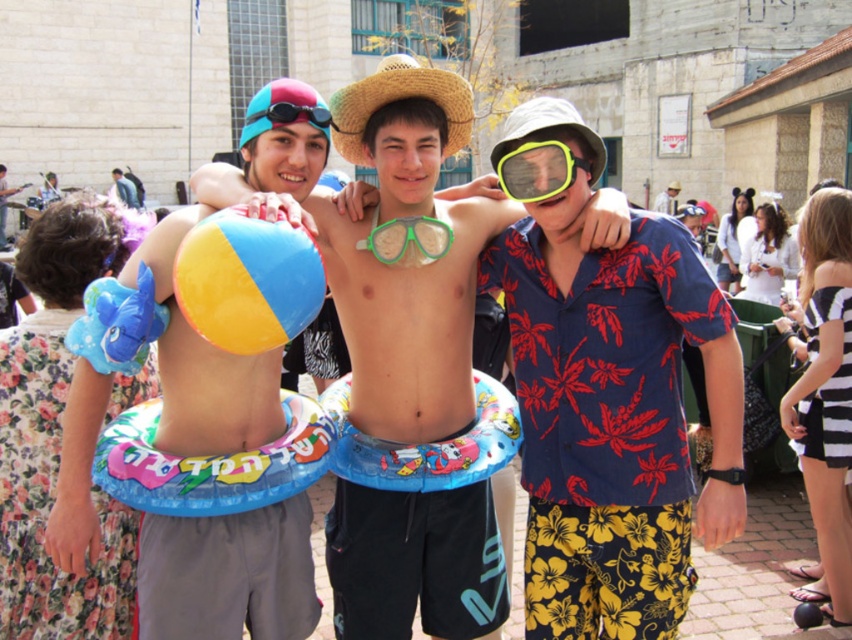
Which of these two, matte plastic beach ball at center or blue matte goggles at center, stands taller?

matte plastic beach ball at center

Describe the element at coordinates (407, 266) in the screenshot. The height and width of the screenshot is (640, 852). I see `matte plastic beach ball at center` at that location.

This screenshot has width=852, height=640. Identify the location of matte plastic beach ball at center. (407, 266).

Locate an element on the screen. Image resolution: width=852 pixels, height=640 pixels. matte plastic beach ball at center is located at coordinates (407, 266).

Which is above, yellowmattebeach ball at center or blue matte goggles at center?

blue matte goggles at center

Does yellowmattebeach ball at center lie in front of blue matte goggles at center?

Yes, yellowmattebeach ball at center is in front of blue matte goggles at center.

The image size is (852, 640). I want to click on yellowmattebeach ball at center, so click(x=246, y=280).

Does blue rubber ring at upper left appear on the right side of white cotton shirt at center?

In fact, blue rubber ring at upper left is to the left of white cotton shirt at center.

Find the location of a particular element. blue rubber ring at upper left is located at coordinates (124, 188).

I want to click on blue rubber ring at upper left, so click(x=124, y=188).

The width and height of the screenshot is (852, 640). Find the location of `blue rubber ring at upper left`. blue rubber ring at upper left is located at coordinates (124, 188).